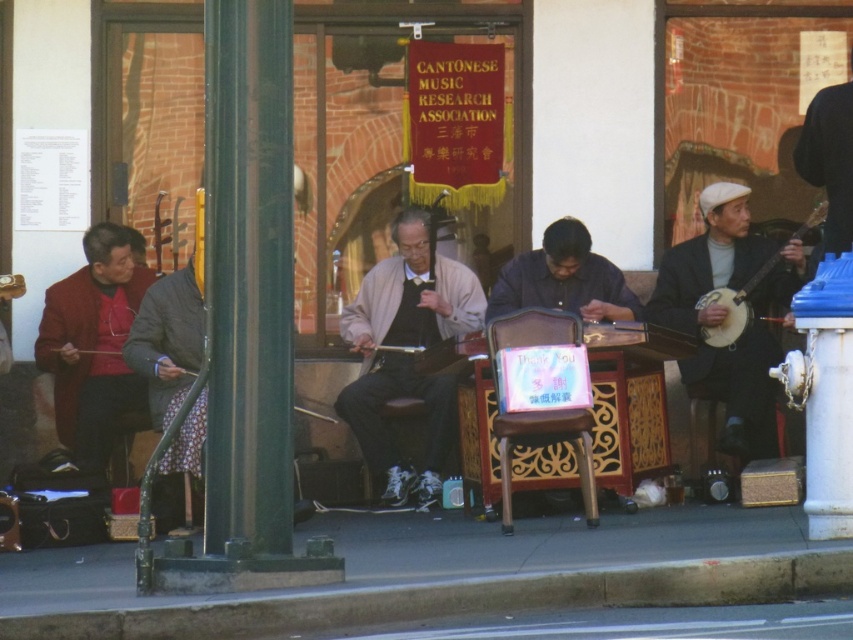
Is point (71, 369) closer to camera compared to point (625, 300)?

No.

Does matte red jacket at left appear over wooden banjo at center?

No.

The image size is (853, 640). Identify the location of matte red jacket at left. (93, 346).

Where is `concrete at lower center`? This screenshot has width=853, height=640. concrete at lower center is located at coordinates [x=445, y=573].

From the picture: Is concrete at lower center positioned at the back of white wooden banjo at right?

No.

The image size is (853, 640). In order to click on concrete at lower center in this screenshot , I will do (x=445, y=573).

Locate an element on the screen. Image resolution: width=853 pixels, height=640 pixels. concrete at lower center is located at coordinates (445, 573).

What do you see at coordinates (445, 573) in the screenshot?
I see `concrete at lower center` at bounding box center [445, 573].

Between point (410, 616) and point (575, 259), which one is positioned behind?

The point (575, 259) is more distant.

You are a GUI agent. You are given a task and a screenshot of the screen. Output one action in this format:
    pyautogui.click(x=<x>, y=<y>)
    Task: Click on the concrete at lower center
    This screenshot has width=853, height=640.
    Given the screenshot: What is the action you would take?
    pyautogui.click(x=445, y=573)